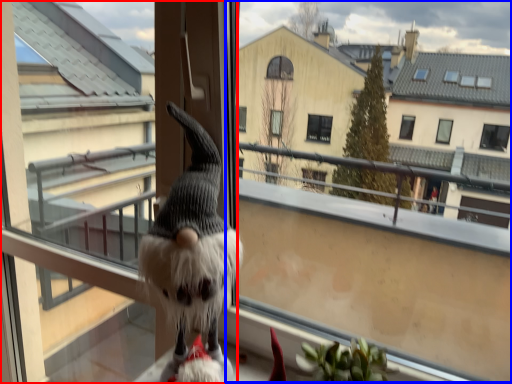
Question: Which of the following is the closest to the observer, screen door (highlighted by a red box) or window screen (highlighted by a blue box)?

Choices:
 (A) screen door
 (B) window screen

Answer: (B)